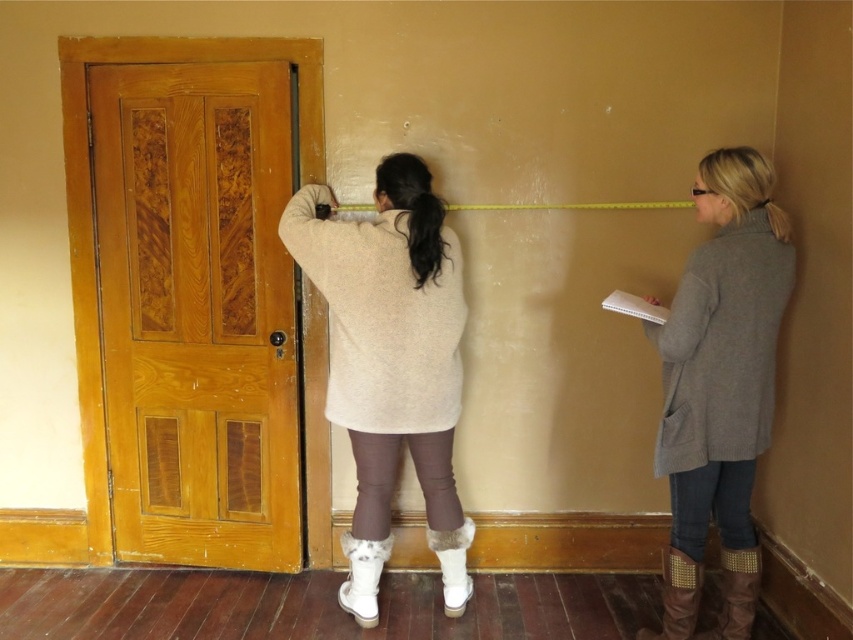
You are standing in front of the wall being measured by the two individuals. There are two points marked on the wall at coordinates point (x=759, y=348) and point (x=456, y=586). Which point is closer to your eyes?

Point (x=759, y=348) is closer to the camera than point (x=456, y=586), so the point closer to your eyes is point (x=759, y=348).

You are an interior designer assessing the space. You notice the gray sweater at right and the brown studded boot at lower right. Which object is positioned higher from the floor?

The gray sweater at right is much taller than the brown studded boot at lower right, so the gray sweater at right is positioned higher from the floor.

You are a tailor measuring a customer for a custom suit. The customer is standing in the scene described. You need to determine if there is enough space between the gray sweater at right and the brown studded boot at lower right to comfortably take a body measurement. Based on the provided information, is the distance sufficient?

The distance between the gray sweater at right and the brown studded boot at lower right is 12.39 inches. This distance is likely sufficient for taking a body measurement as it provides enough space for the tailor to maneuver comfortably.